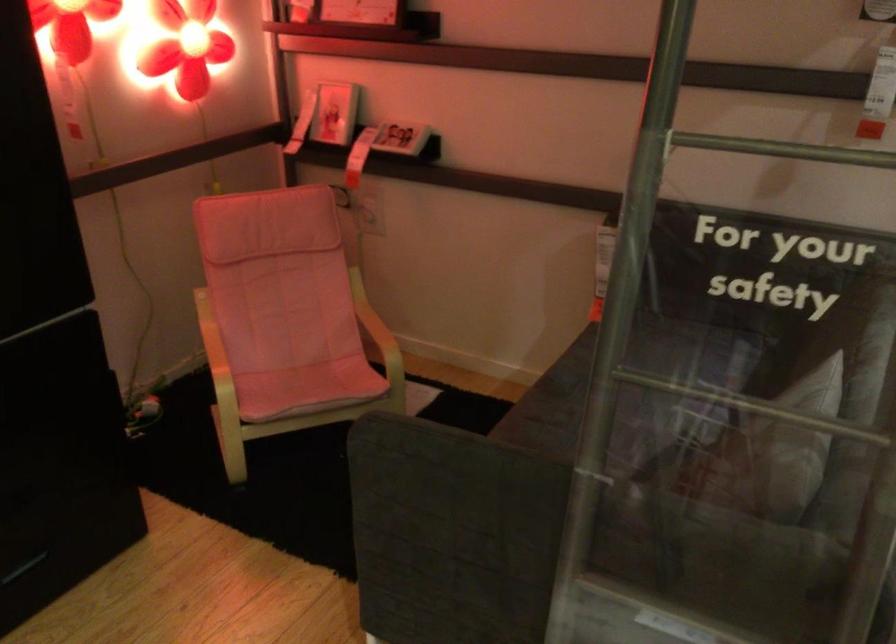
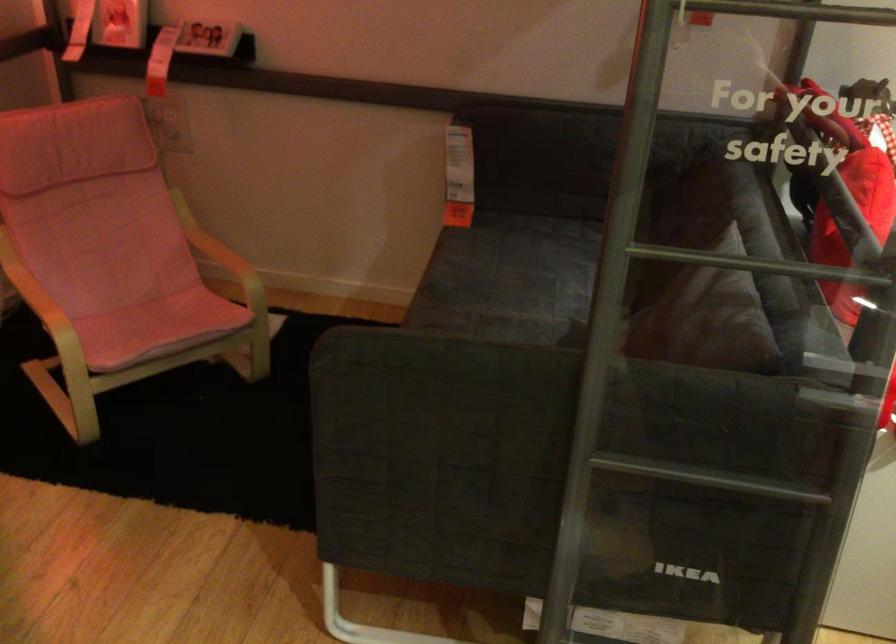
Question: How did the camera likely rotate?

Choices:
 (A) Left
 (B) Right
 (C) Up
 (D) Down

Answer: (B)